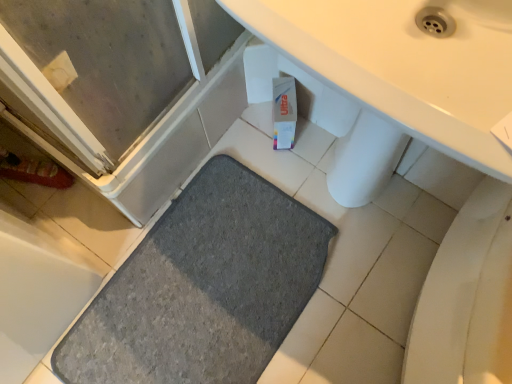
Describe the element at coordinates (38, 292) in the screenshot. I see `gray rubber mat at lower left` at that location.

In order to face gray rubber mat at lower left, should I rotate leftwards or rightwards?

To face it directly, rotate left by 36.536 degrees.

The width and height of the screenshot is (512, 384). Identify the location of gray rubber mat at lower left. (38, 292).

Measure the distance between gray carpet at lower left and camera.

A distance of 1.11 meters exists between gray carpet at lower left and camera.

Locate an element on the screen. The height and width of the screenshot is (384, 512). gray carpet at lower left is located at coordinates point(203,287).

Describe the element at coordinates (203, 287) in the screenshot. This screenshot has height=384, width=512. I see `gray carpet at lower left` at that location.

Image resolution: width=512 pixels, height=384 pixels. What are the coordinates of `gray rubber mat at lower left` in the screenshot? It's located at (38, 292).

In the image, is gray carpet at lower left on the left side or the right side of gray rubber mat at lower left?

gray carpet at lower left is to the right of gray rubber mat at lower left.

In the image, is gray carpet at lower left positioned in front of or behind gray rubber mat at lower left?

Visually, gray carpet at lower left is located behind gray rubber mat at lower left.

Is point (175, 353) behind point (5, 308)?

Yes, point (175, 353) is farther from viewer.

Looking at this image, from the image's perspective, would you say gray carpet at lower left is positioned over gray rubber mat at lower left?

Actually, gray carpet at lower left appears below gray rubber mat at lower left in the image.

From a real-world perspective, who is located higher, gray carpet at lower left or gray rubber mat at lower left?

In real-world perspective, gray rubber mat at lower left is above.

Is gray carpet at lower left wider or thinner than gray rubber mat at lower left?

Considering their sizes, gray carpet at lower left looks broader than gray rubber mat at lower left.

Considering the relative sizes of gray carpet at lower left and gray rubber mat at lower left in the image provided, is gray carpet at lower left shorter than gray rubber mat at lower left?

Yes.

Considering the relative sizes of gray carpet at lower left and gray rubber mat at lower left in the image provided, is gray carpet at lower left bigger than gray rubber mat at lower left?

Incorrect, gray carpet at lower left is not larger than gray rubber mat at lower left.

Is gray carpet at lower left spatially inside gray rubber mat at lower left, or outside of it?

gray carpet at lower left is not enclosed by gray rubber mat at lower left.

From the picture: Is gray carpet at lower left in contact with gray rubber mat at lower left?

gray carpet at lower left is not next to gray rubber mat at lower left, and they're not touching.

Could you tell me if gray carpet at lower left is facing gray rubber mat at lower left?

No, gray carpet at lower left is not aimed at gray rubber mat at lower left.

At what (x,y) coordinates should I click in order to perform the action: click on bath lying above the gray carpet at lower left (from the image's perspective). Please return your answer as a coordinate pair (x, y). This screenshot has height=384, width=512. Looking at the image, I should click on (38, 292).

Does gray rubber mat at lower left appear on the left side of gray carpet at lower left?

Yes.

Considering the positions of objects gray rubber mat at lower left and gray carpet at lower left in the image provided, who is behind, gray rubber mat at lower left or gray carpet at lower left?

gray carpet at lower left is further from the camera.

Between point (24, 324) and point (120, 347), which one is positioned behind?

The point (120, 347) is farther.

From the image's perspective, is gray rubber mat at lower left located above or below gray carpet at lower left?

gray rubber mat at lower left is situated higher than gray carpet at lower left in the image.

From a real-world perspective, between gray rubber mat at lower left and gray carpet at lower left, who is vertically higher?

From a 3D spatial view, gray rubber mat at lower left is above.

In the scene shown: In terms of width, does gray rubber mat at lower left look wider or thinner when compared to gray carpet at lower left?

gray rubber mat at lower left is thinner than gray carpet at lower left.

Does gray rubber mat at lower left have a greater height compared to gray carpet at lower left?

Indeed, gray rubber mat at lower left has a greater height compared to gray carpet at lower left.

Based on the photo, considering the sizes of objects gray rubber mat at lower left and gray carpet at lower left in the image provided, who is smaller, gray rubber mat at lower left or gray carpet at lower left?

gray carpet at lower left.

Is gray rubber mat at lower left located outside gray carpet at lower left?

Yes.

Can you see gray rubber mat at lower left touching gray carpet at lower left?

No, gray rubber mat at lower left is not touching gray carpet at lower left.

Is gray rubber mat at lower left oriented towards gray carpet at lower left?

Yes, gray rubber mat at lower left is aimed at gray carpet at lower left.

How distant is gray rubber mat at lower left from gray carpet at lower left?

gray rubber mat at lower left is 10.71 inches away from gray carpet at lower left.

In order to click on bath mat behind the gray rubber mat at lower left in this screenshot , I will do `click(203, 287)`.

This screenshot has width=512, height=384. Identify the location of bath mat lying on the right of gray rubber mat at lower left. (203, 287).

Locate an element on the screen. This screenshot has height=384, width=512. bath that is above the gray carpet at lower left (from the image's perspective) is located at coordinates (38, 292).